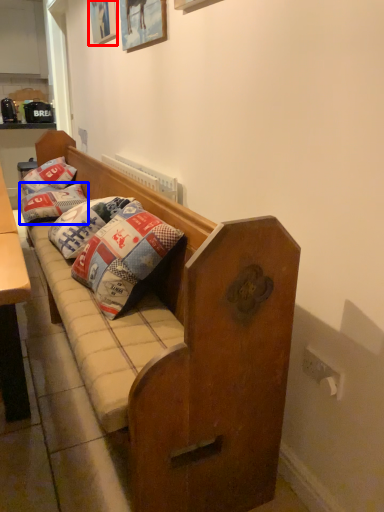
Question: Among these objects, which one is farthest to the camera, picture frame (highlighted by a red box) or pillow (highlighted by a blue box)?

Choices:
 (A) picture frame
 (B) pillow

Answer: (B)